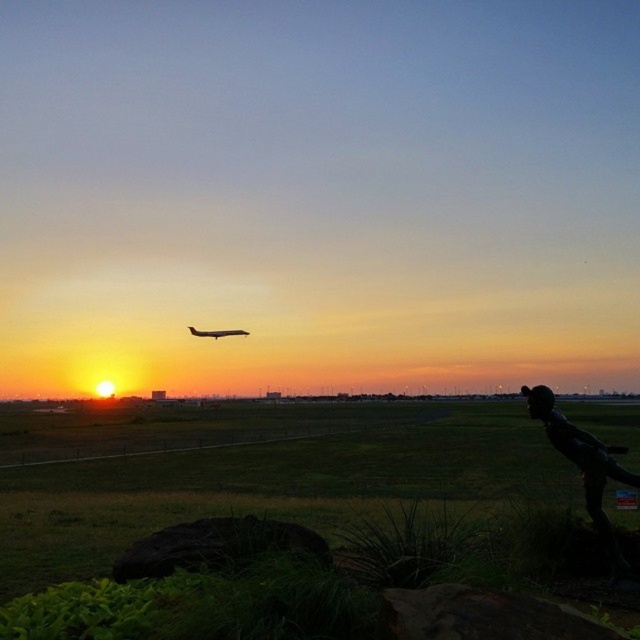
In the scene shown: You are a photographer standing at the edge of the runway. You want to take a photo of the metallic airplane at center without the black matte statue at lower right appearing in the foreground. Is the statue currently blocking your view of the airplane?

The black matte statue at lower right is in front of the metallic airplane at center, so it is blocking your view of the airplane. You would need to move to a different position to avoid the statue.

You are a photographer trying to capture the sunset at the airport. You have two subjects in your viewfinder, the black matte statue at lower right and the metallic airplane at center. Which one should you focus on to get a larger subject in your photo?

The metallic airplane at center is larger than the black matte statue at lower right, so focusing on the metallic airplane at center will give a larger subject in the photo.